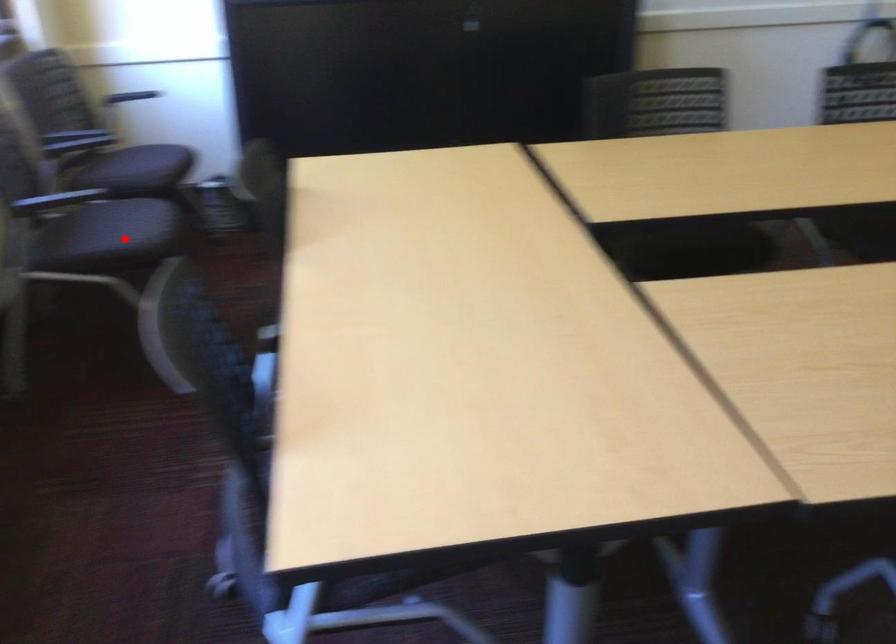
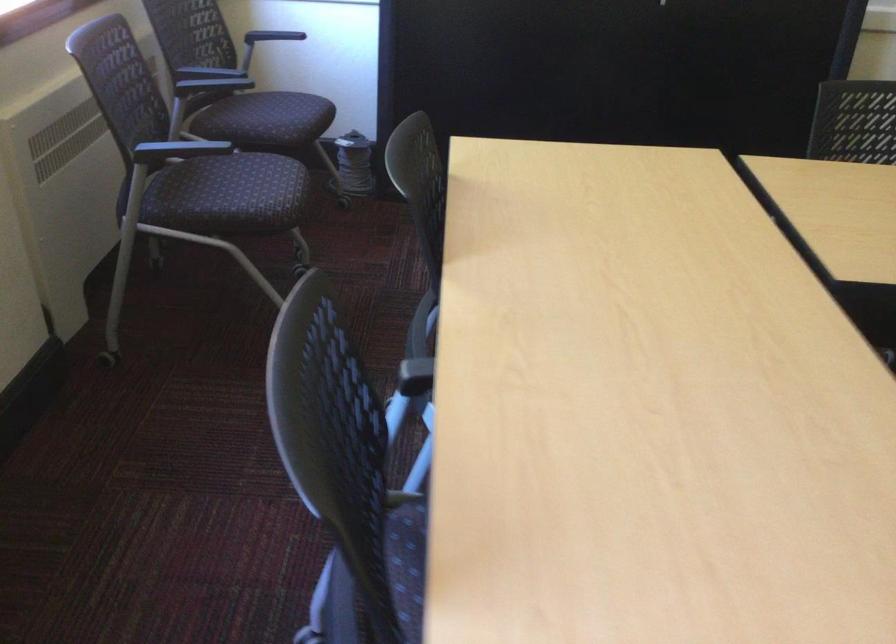
Locate, in the second image, the point that corresponds to the highlighted location in the first image.

(250, 198)